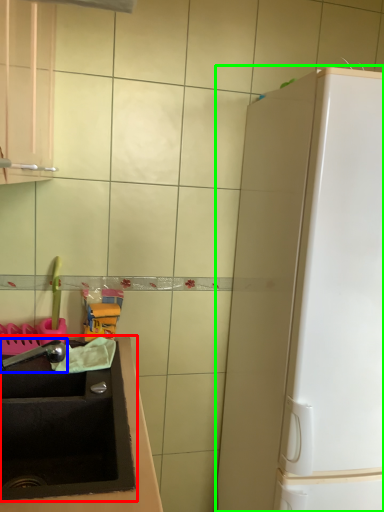
Question: Which object is positioned farthest from sink (highlighted by a red box)? Select from faucet (highlighted by a blue box) and appliance (highlighted by a green box).

Choices:
 (A) faucet
 (B) appliance

Answer: (B)